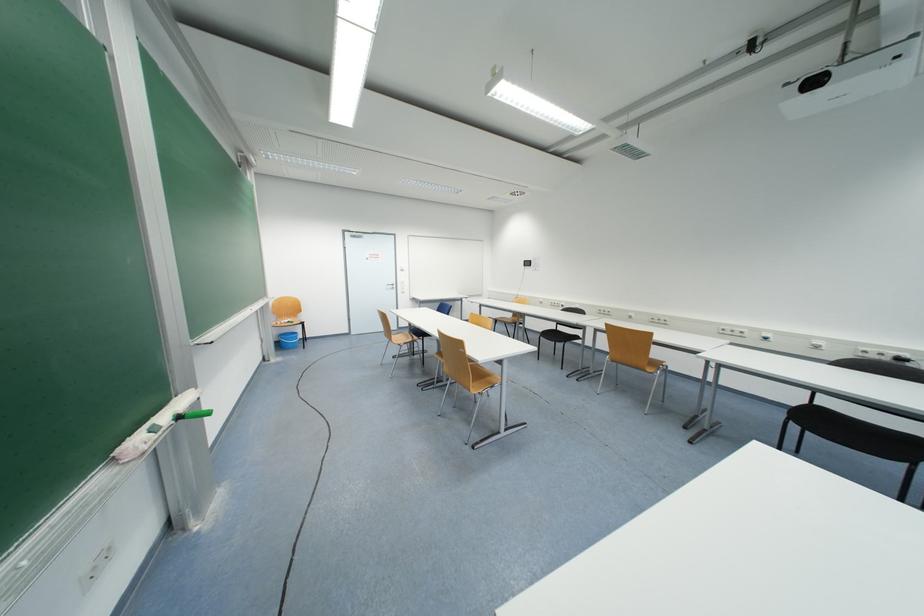
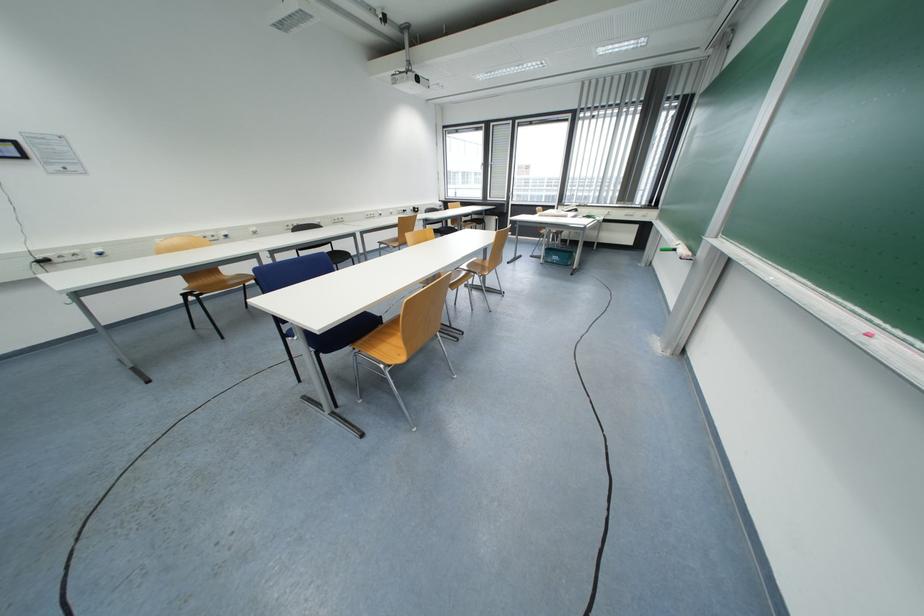
The point at (584, 334) is marked in the first image. Where is the corresponding point in the second image?

(332, 251)